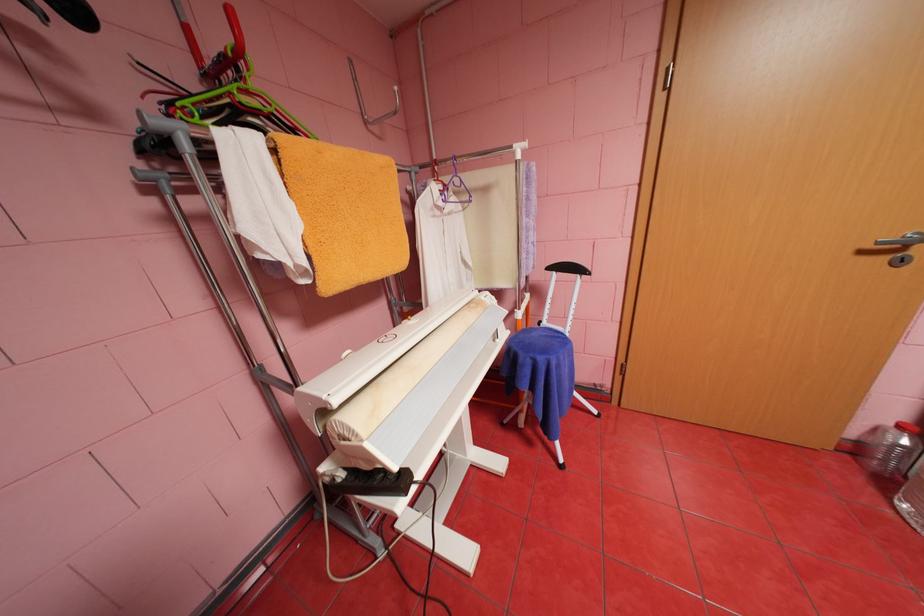
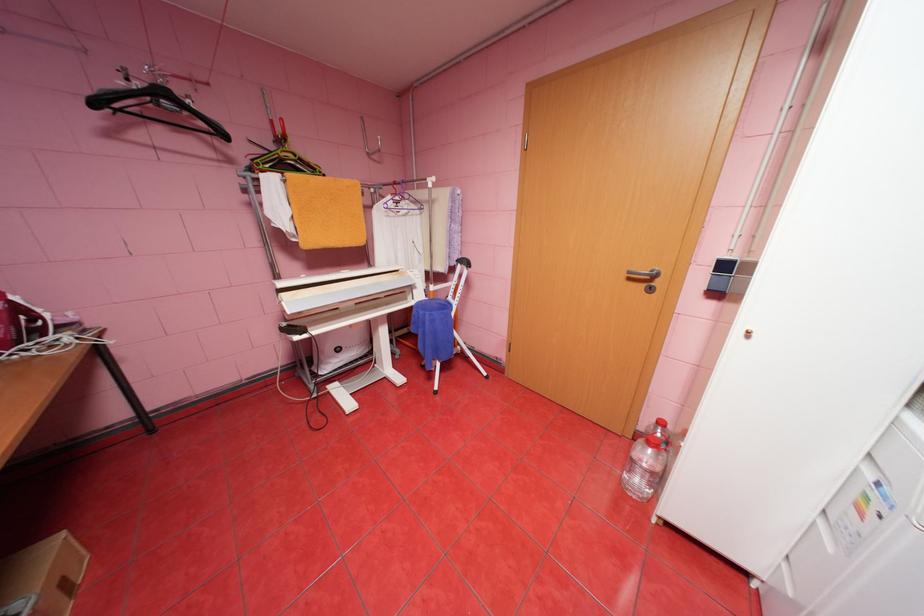
In the second image, find the point that corresponds to (x=893, y=257) in the first image.

(650, 285)